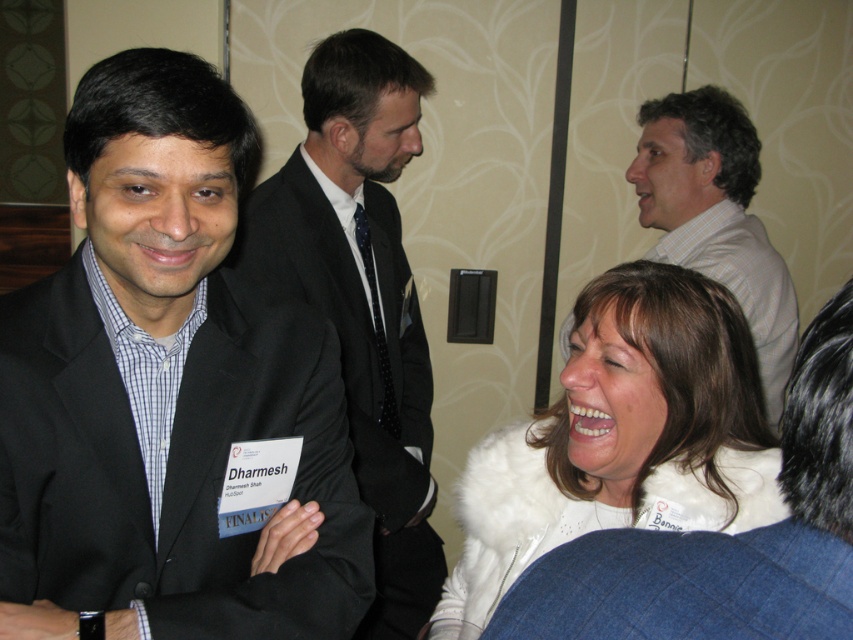
What is located at the coordinate point [363,296] in the image?

The dark gray suit at center is located at the coordinate point [363,296].

Looking at this image, you are a photographer standing 5 feet away from the camera. You want to adjust the focus on the dark gray suit at center. Can you reach the camera to make the adjustment?

The dark gray suit at center and camera are 4.98 feet apart from each other. Since you are standing 5 feet away from the camera, you are just slightly out of reach to adjust the camera directly. You might need to take a small step closer or use a remote control.